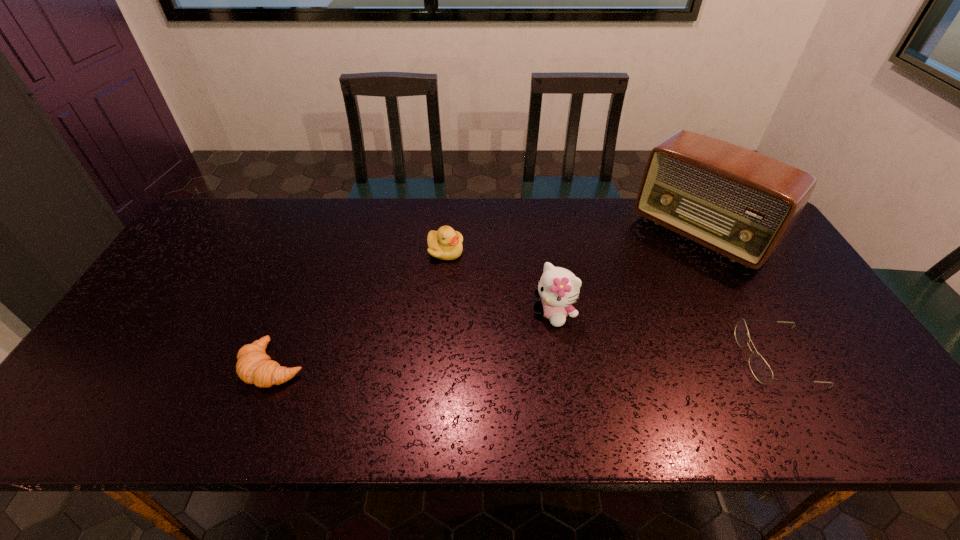
Identify the location of empty location between the third object from right to left and the duckling. (499, 282).

Find the location of `empty space that is in between the third object from left to right and the spectacles`. empty space that is in between the third object from left to right and the spectacles is located at coordinates (665, 335).

At what (x,y) coordinates should I click in order to perform the action: click on free space between the fourth object from right to left and the radio receiver. Please return your answer as a coordinate pair (x, y). This screenshot has width=960, height=540. Looking at the image, I should click on (573, 242).

Identify which object is located as the third nearest to the third object from left to right. Please provide its 2D coordinates. Your answer should be formatted as a tuple, i.e. [(x, y)], where the tuple contains the x and y coordinates of a point satisfying the conditions above.

[(760, 369)]

Identify which object is located as the fourth nearest to the leftmost object. Please provide its 2D coordinates. Your answer should be formatted as a tuple, i.e. [(x, y)], where the tuple contains the x and y coordinates of a point satisfying the conditions above.

[(760, 369)]

I want to click on free spot that satisfies the following two spatial constraints: 1. on the front side of the duckling; 2. on the front-facing side of the spectacles, so click(x=437, y=357).

You are a GUI agent. You are given a task and a screenshot of the screen. Output one action in this format:
    pyautogui.click(x=<x>, y=<y>)
    Task: Click on the vacant area that satisfies the following two spatial constraints: 1. on the back side of the third object from left to right; 2. on the right side of the radio receiver
    
    Given the screenshot: What is the action you would take?
    point(541,234)

This screenshot has width=960, height=540. Find the location of `vacant space that satisfies the following two spatial constraints: 1. on the front side of the tallest object; 2. on the front-facing side of the spectacles`. vacant space that satisfies the following two spatial constraints: 1. on the front side of the tallest object; 2. on the front-facing side of the spectacles is located at coordinates (768, 357).